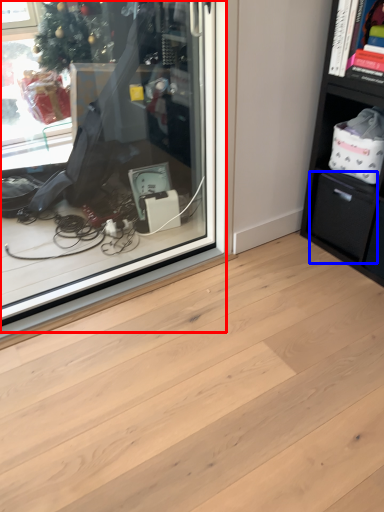
Question: Which of the following is the closest to the observer, shop window (highlighted by a red box) or drawer (highlighted by a blue box)?

Choices:
 (A) shop window
 (B) drawer

Answer: (A)